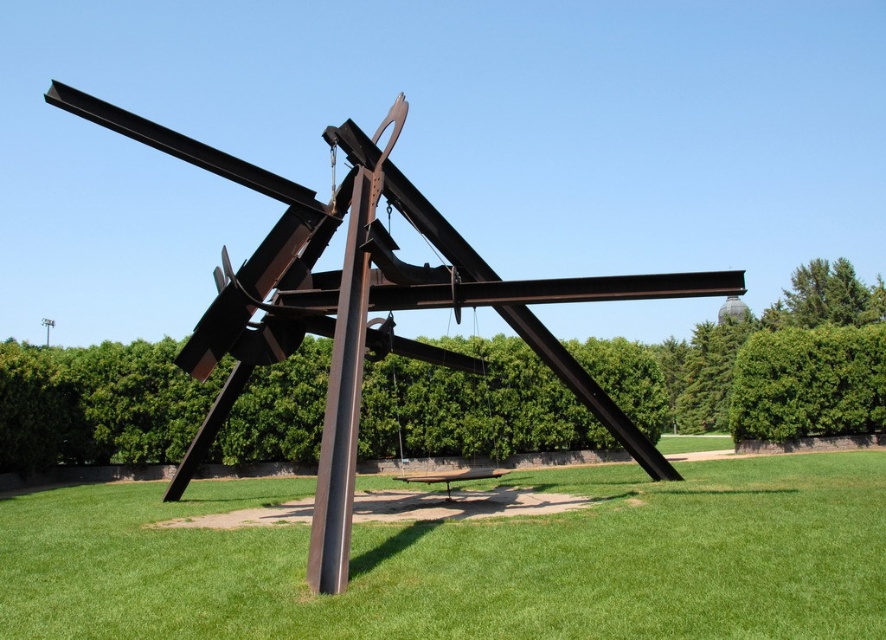
Is green grass at center taller than rustic metal sculpture at center?

Incorrect, green grass at center's height is not larger of rustic metal sculpture at center's.

Consider the image. Can you confirm if green grass at center is smaller than rustic metal sculpture at center?

Yes.

The height and width of the screenshot is (640, 886). In order to click on green grass at center in this screenshot , I will do `click(470, 561)`.